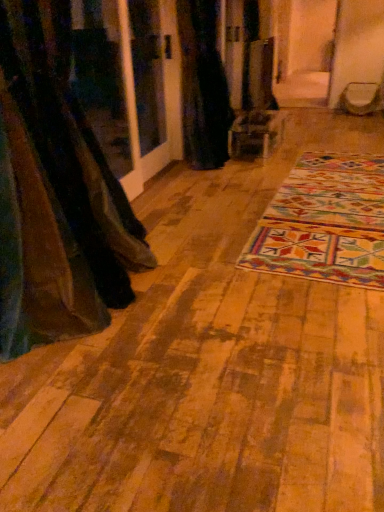
At what (x,y) coordinates should I click in order to perform the action: click on free point in front of brown fabric curtain at left, the 1th curtain viewed from the front. Please return your answer as a coordinate pair (x, y). The height and width of the screenshot is (512, 384). Looking at the image, I should click on (76, 420).